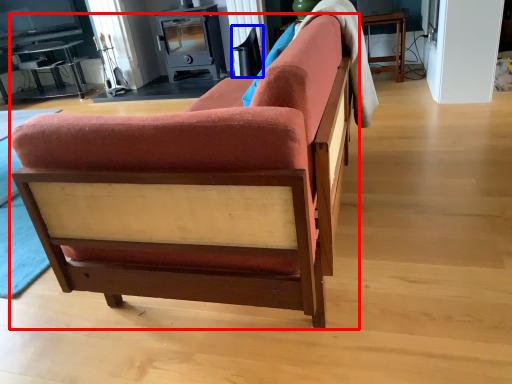
Question: Which point is further to the camera, studio couch (highlighted by a red box) or swivel chair (highlighted by a blue box)?

Choices:
 (A) studio couch
 (B) swivel chair

Answer: (B)